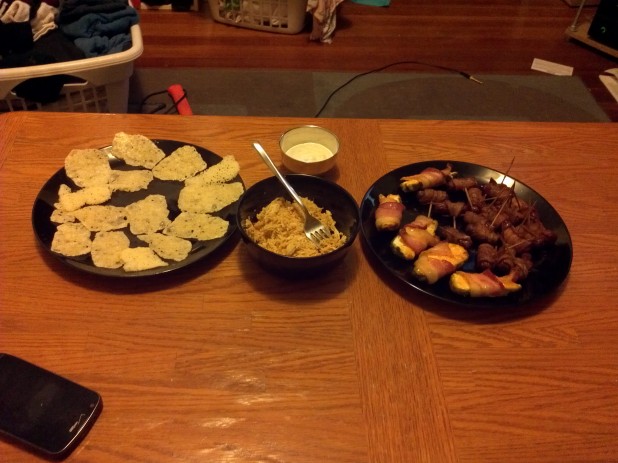
Find the location of a particular element. This screenshot has height=463, width=618. plates sitting on table is located at coordinates (206, 249), (447, 296).